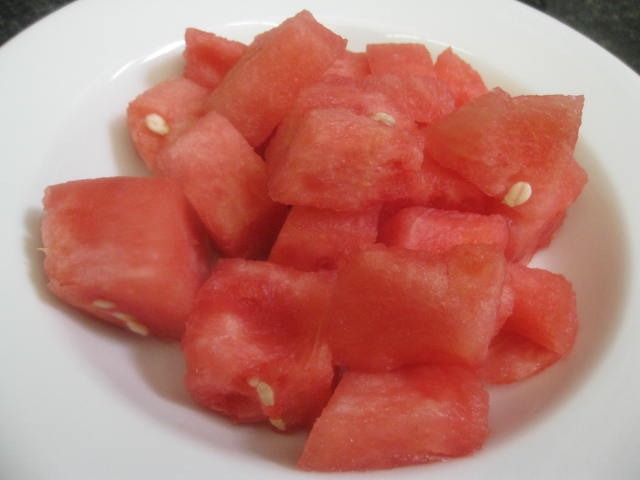
Find the location of a particular element. The image size is (640, 480). black speckled counter top is located at coordinates (602, 23), (10, 18).